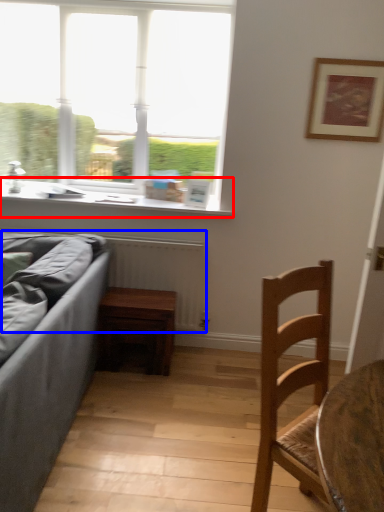
Question: Which object appears closest to the camera in this image, window sill (highlighted by a red box) or radiator (highlighted by a blue box)?

Choices:
 (A) window sill
 (B) radiator

Answer: (B)